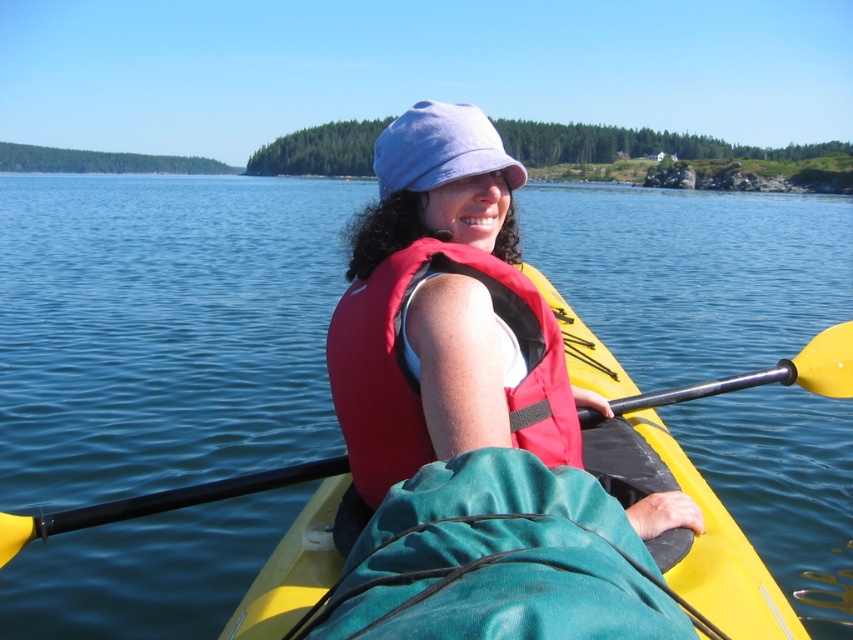
You are a drone operator trying to locate a specific point in the image. The point is labeled as point (161,328). Based on the scene description, where would this point be located in relation to the blue water at center?

The point (161,328) is located on the blue water at center.